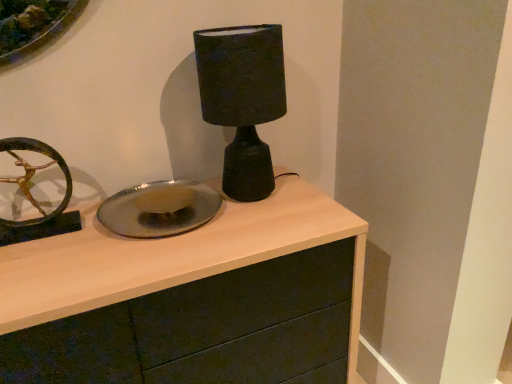
Question: Does matte black lamp at center appear on the left side of matte wood chest of drawers at center?

Choices:
 (A) no
 (B) yes

Answer: (A)

Question: Is matte black lamp at center aimed at matte wood chest of drawers at center?

Choices:
 (A) yes
 (B) no

Answer: (B)

Question: From the image's perspective, is matte black lamp at center located beneath matte wood chest of drawers at center?

Choices:
 (A) yes
 (B) no

Answer: (B)

Question: Is matte black lamp at center smaller than matte wood chest of drawers at center?

Choices:
 (A) yes
 (B) no

Answer: (A)

Question: Does matte black lamp at center appear on the right side of matte wood chest of drawers at center?

Choices:
 (A) yes
 (B) no

Answer: (A)

Question: From a real-world perspective, does matte black lamp at center stand above matte wood chest of drawers at center?

Choices:
 (A) no
 (B) yes

Answer: (B)

Question: Is shiny metallic plate at center positioned far away from matte black lamp at center?

Choices:
 (A) no
 (B) yes

Answer: (A)

Question: Is shiny metallic plate at center closer to the viewer compared to matte black lamp at center?

Choices:
 (A) no
 (B) yes

Answer: (A)

Question: From the image's perspective, is shiny metallic plate at center over matte black lamp at center?

Choices:
 (A) yes
 (B) no

Answer: (B)

Question: Is shiny metallic plate at center facing away from matte black lamp at center?

Choices:
 (A) no
 (B) yes

Answer: (A)

Question: Considering the relative sizes of shiny metallic plate at center and matte black lamp at center in the image provided, is shiny metallic plate at center smaller than matte black lamp at center?

Choices:
 (A) no
 (B) yes

Answer: (B)

Question: Can you confirm if shiny metallic plate at center is wider than matte black lamp at center?

Choices:
 (A) no
 (B) yes

Answer: (B)

Question: From a real-world perspective, is matte black lamp at center physically above shiny metallic plate at center?

Choices:
 (A) no
 (B) yes

Answer: (B)